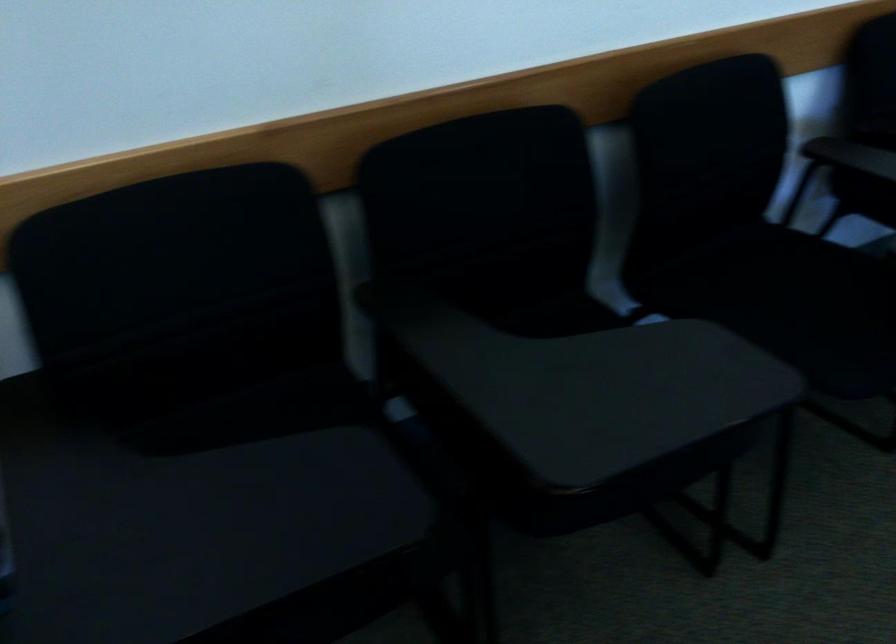
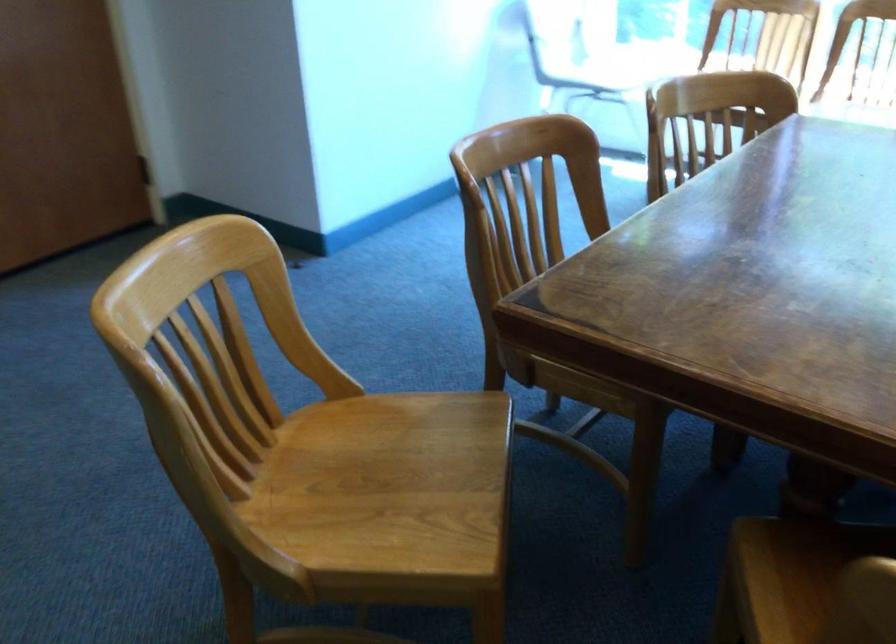
First-person continuous shooting, in which direction is the camera rotating?

The camera's rotation is toward right-down.